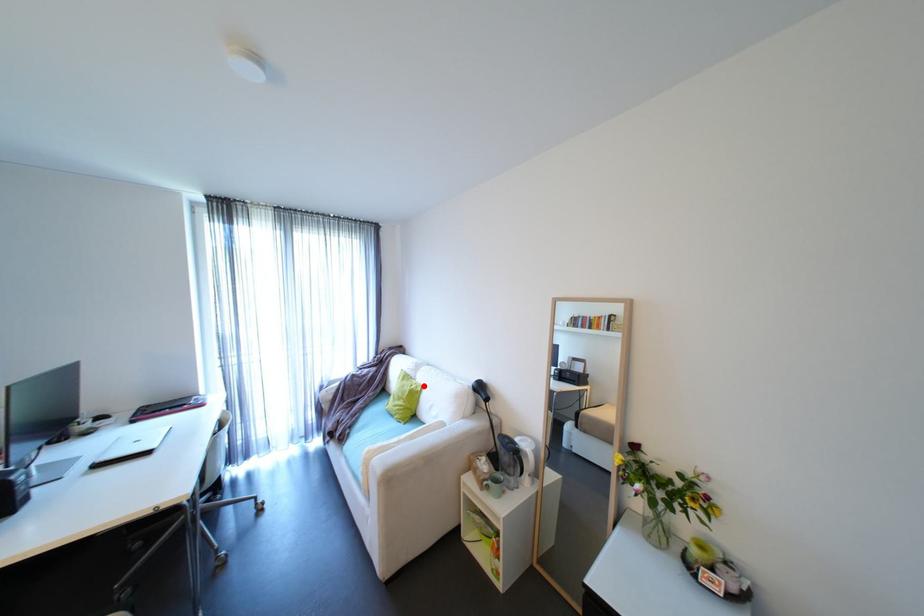
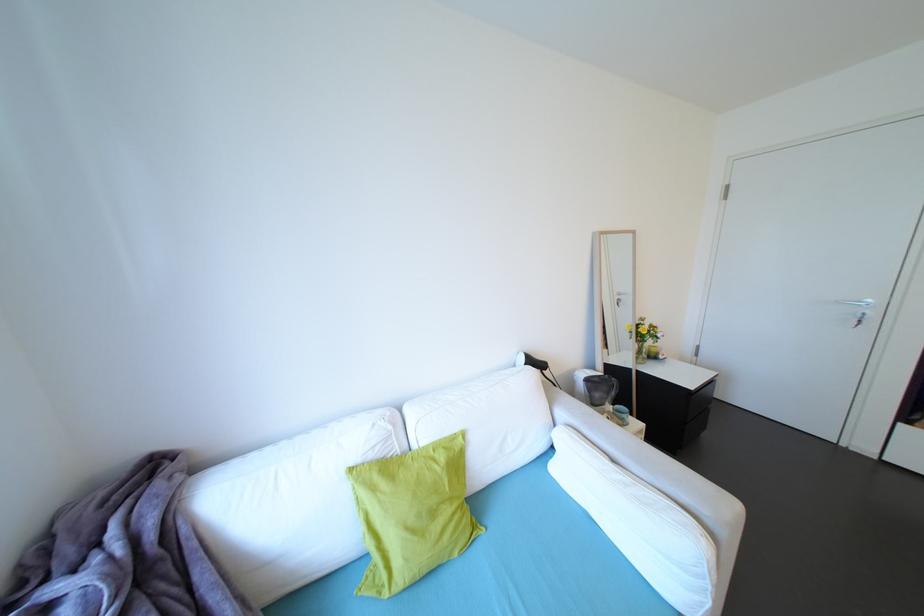
Locate, in the second image, the point that corresponds to the highlighted location in the first image.

(451, 448)